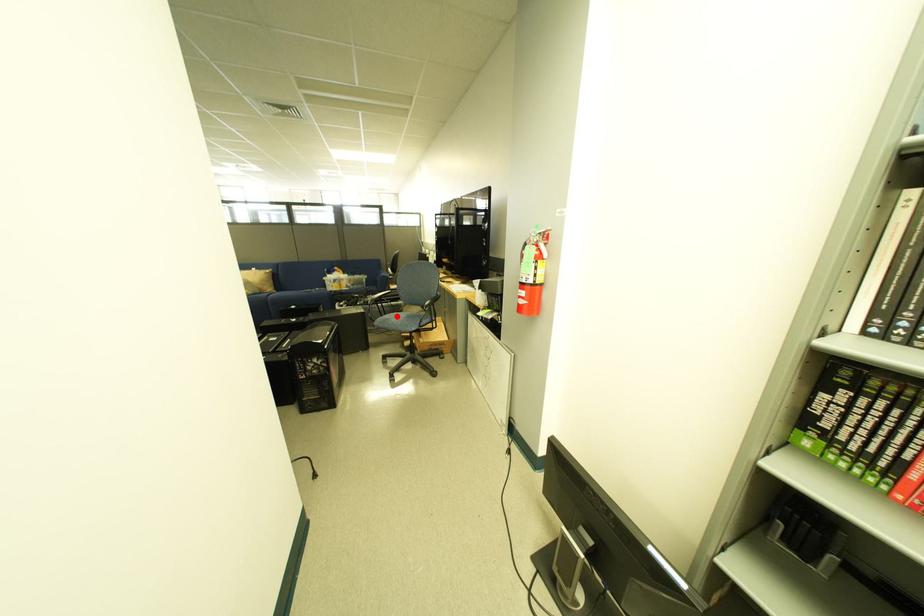
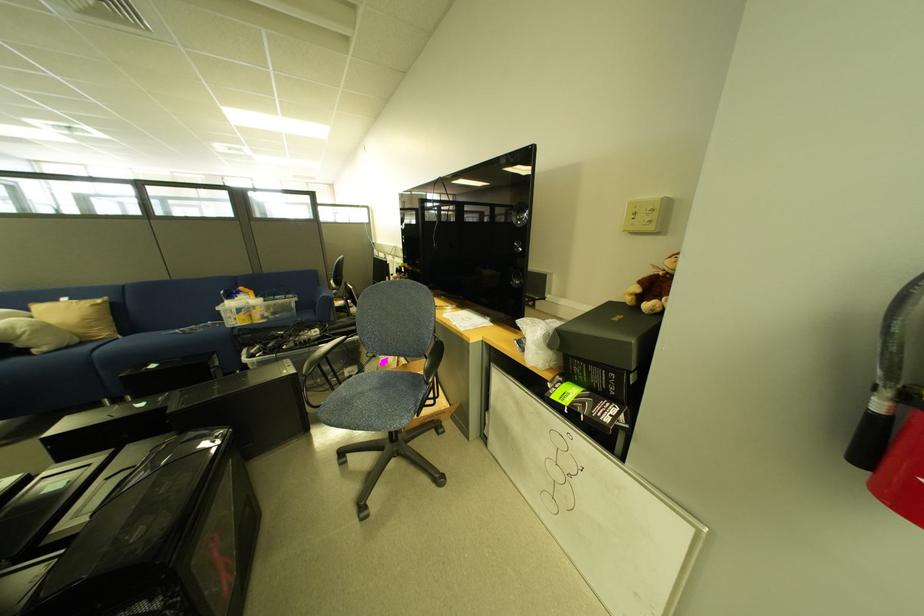
Locate, in the second image, the point that corresponds to the highlighted location in the first image.

(350, 386)